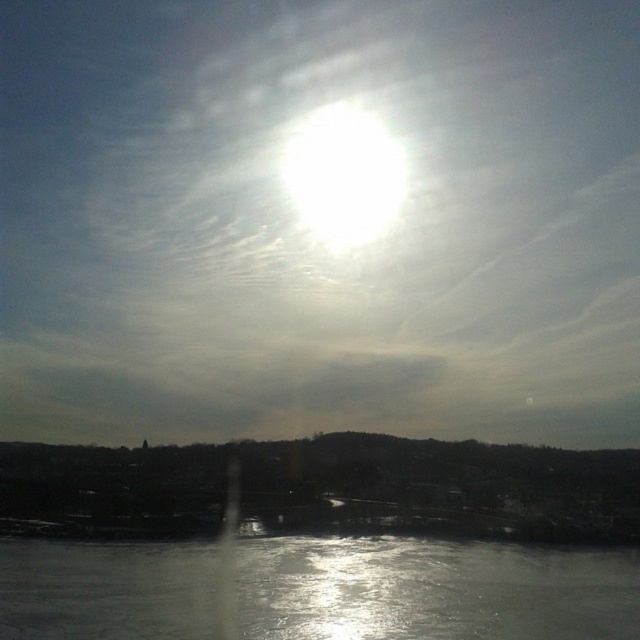
Question: Which point is closer to the camera?

Choices:
 (A) (570, 595)
 (B) (545, 243)

Answer: (A)

Question: Is bright white sun at upper center behind glistening ice at bottom?

Choices:
 (A) yes
 (B) no

Answer: (A)

Question: In this image, where is bright white sun at upper center located relative to glistening ice at bottom?

Choices:
 (A) left
 (B) right

Answer: (A)

Question: Does bright white sun at upper center appear over glistening ice at bottom?

Choices:
 (A) yes
 (B) no

Answer: (A)